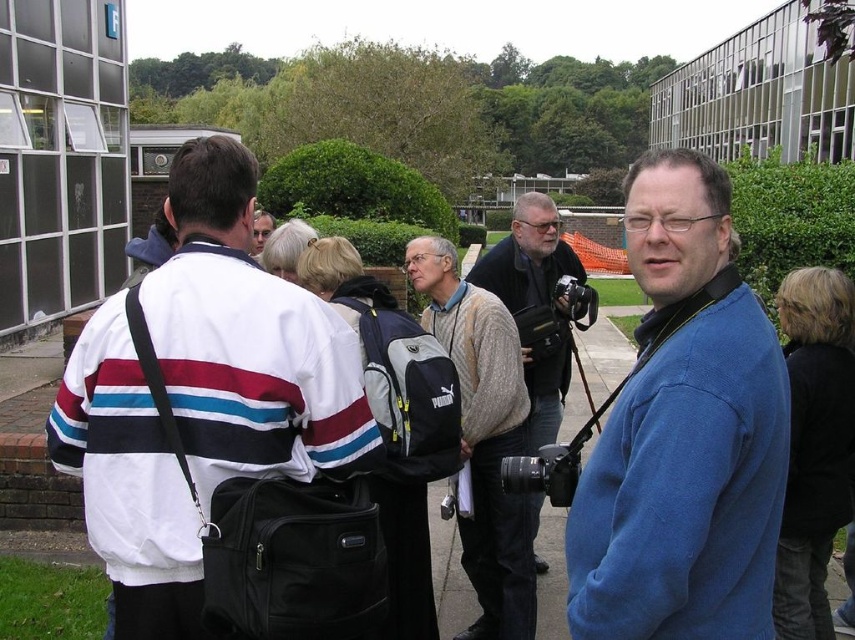
Does blue fleece jacket at right have a smaller size compared to knitted sweater at center?

Correct, blue fleece jacket at right occupies less space than knitted sweater at center.

The width and height of the screenshot is (855, 640). Describe the element at coordinates (684, 433) in the screenshot. I see `blue fleece jacket at right` at that location.

This screenshot has height=640, width=855. I want to click on blue fleece jacket at right, so click(x=684, y=433).

Does blue fleece jacket at right appear under matte black camera at center?

Incorrect, blue fleece jacket at right is not positioned below matte black camera at center.

Measure the distance from blue fleece jacket at right to matte black camera at center.

blue fleece jacket at right is 3.08 meters away from matte black camera at center.

Locate an element on the screen. The width and height of the screenshot is (855, 640). blue fleece jacket at right is located at coordinates (684, 433).

What do you see at coordinates (248, 340) in the screenshot?
I see `white striped jacket at upper left` at bounding box center [248, 340].

I want to click on white striped jacket at upper left, so click(x=248, y=340).